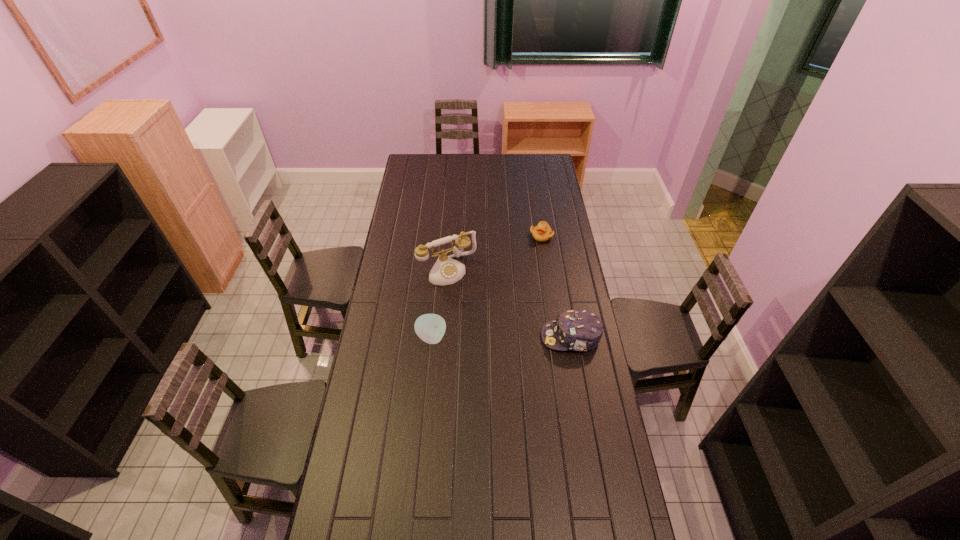
At what (x,y) coordinates should I click in order to perform the action: click on free space at the left edge. Please return your answer as a coordinate pair (x, y). This screenshot has height=540, width=960. Looking at the image, I should click on (362, 373).

Image resolution: width=960 pixels, height=540 pixels. In order to click on vacant space at the right edge of the desktop in this screenshot , I will do `click(548, 190)`.

Where is `blank region between the tallest object and the headwear`? This screenshot has height=540, width=960. blank region between the tallest object and the headwear is located at coordinates (510, 303).

This screenshot has width=960, height=540. I want to click on free space between the apple and the telephone, so click(440, 304).

The width and height of the screenshot is (960, 540). Identify the location of free space between the apple and the tallest object. (440, 304).

Where is `free space between the shortest object and the apple`? This screenshot has height=540, width=960. free space between the shortest object and the apple is located at coordinates (487, 287).

This screenshot has height=540, width=960. Find the location of `vacant region between the shortest object and the third nearest object`. vacant region between the shortest object and the third nearest object is located at coordinates (494, 253).

The width and height of the screenshot is (960, 540). In order to click on vacant area that lies between the tallest object and the apple in this screenshot , I will do `click(440, 304)`.

At what (x,y) coordinates should I click in order to perform the action: click on empty space that is in between the apple and the farthest object. Please return your answer as a coordinate pair (x, y). This screenshot has height=540, width=960. Looking at the image, I should click on (487, 287).

Find the location of a particular element. The image size is (960, 540). vacant area that lies between the headwear and the apple is located at coordinates tap(501, 338).